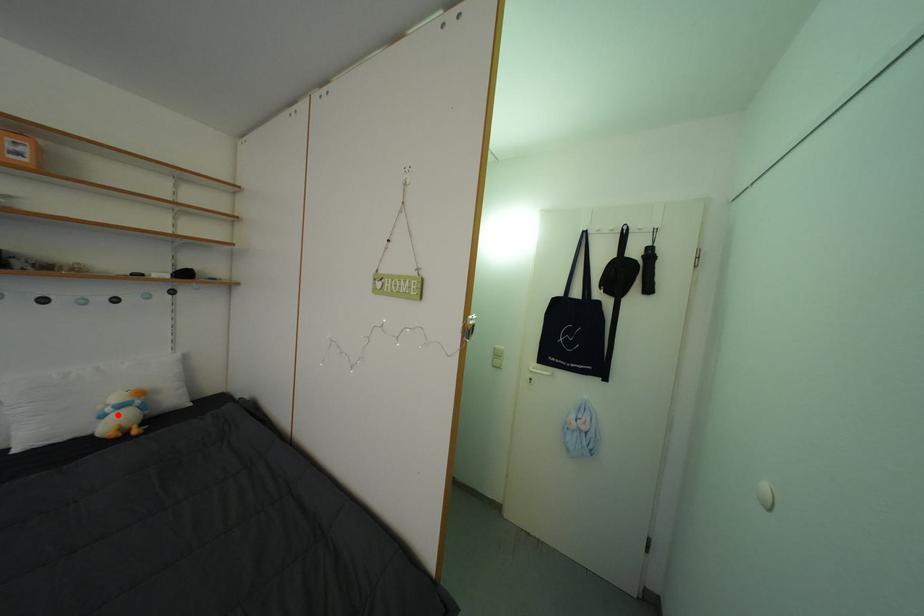
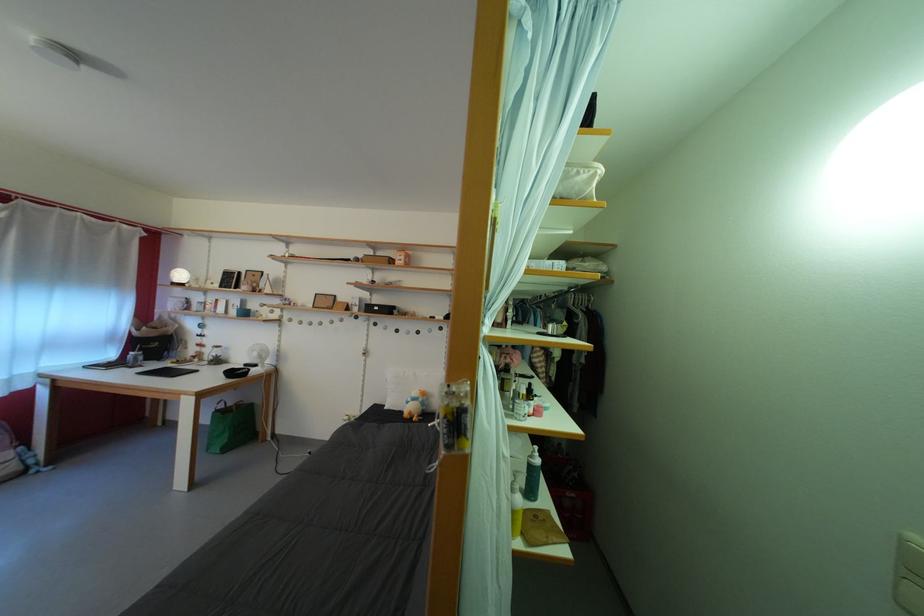
Locate, in the second image, the point that corresponds to the highlighted location in the first image.

(418, 405)